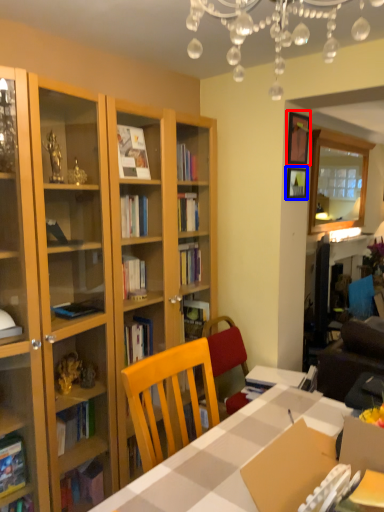
Question: Which point is closer to the camera, picture frame (highlighted by a red box) or picture frame (highlighted by a blue box)?

Choices:
 (A) picture frame
 (B) picture frame

Answer: (A)